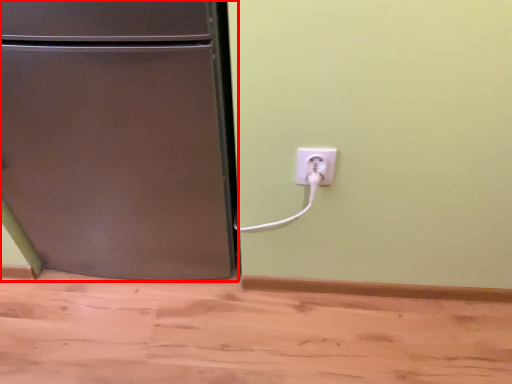
Question: From the image, what is the correct spatial relationship of refrigerator (annotated by the red box) in relation to power plugs and sockets?

Choices:
 (A) left
 (B) right

Answer: (A)